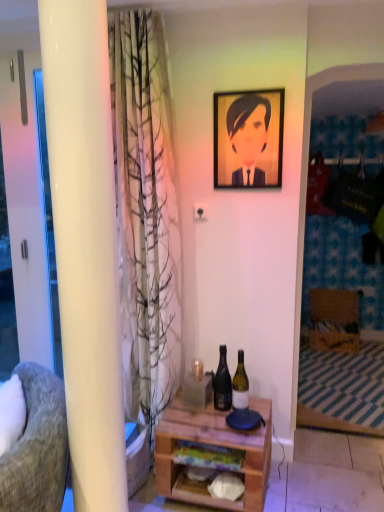
Locate an element on the screen. The height and width of the screenshot is (512, 384). free spot above wooden desk at center (from a real-world perspective) is located at coordinates (211, 420).